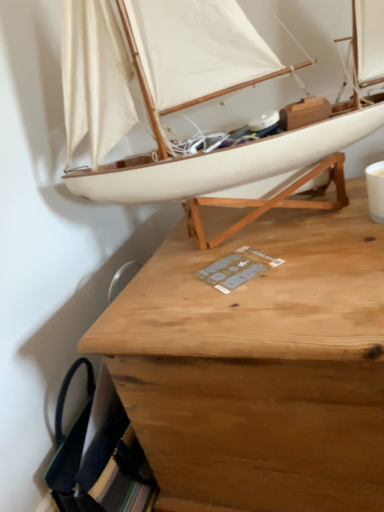
This screenshot has width=384, height=512. What do you see at coordinates (259, 366) in the screenshot? I see `wooden desk at center` at bounding box center [259, 366].

Locate an element on the screen. This screenshot has width=384, height=512. wooden desk at center is located at coordinates (259, 366).

This screenshot has width=384, height=512. What do you see at coordinates (230, 167) in the screenshot?
I see `white matte sailboat at upper center` at bounding box center [230, 167].

The image size is (384, 512). I want to click on white matte sailboat at upper center, so click(230, 167).

The width and height of the screenshot is (384, 512). Find the location of `wooden desk at center`. wooden desk at center is located at coordinates (259, 366).

Between wooden desk at center and white matte sailboat at upper center, which one appears on the right side from the viewer's perspective?

Positioned to the right is wooden desk at center.

Considering their positions, is wooden desk at center located in front of or behind white matte sailboat at upper center?

Visually, wooden desk at center is located behind white matte sailboat at upper center.

Is point (128, 397) positioned before point (294, 204)?

That is True.

From the image's perspective, is wooden desk at center above white matte sailboat at upper center?

Incorrect, from the image's perspective, wooden desk at center is lower than white matte sailboat at upper center.

From a real-world perspective, does wooden desk at center stand above white matte sailboat at upper center?

Actually, wooden desk at center is physically below white matte sailboat at upper center in the real world.

Between wooden desk at center and white matte sailboat at upper center, which one has larger width?

With larger width is wooden desk at center.

Does wooden desk at center have a lesser height compared to white matte sailboat at upper center?

No.

Is wooden desk at center bigger than white matte sailboat at upper center?

Yes, wooden desk at center is bigger than white matte sailboat at upper center.

Would you say wooden desk at center contains white matte sailboat at upper center?

No, wooden desk at center does not contain white matte sailboat at upper center.

Would you consider wooden desk at center to be distant from white matte sailboat at upper center?

No, wooden desk at center is not far away from white matte sailboat at upper center.

Is wooden desk at center facing towards white matte sailboat at upper center?

No, wooden desk at center is not facing towards white matte sailboat at upper center.

Can you tell me how much wooden desk at center and white matte sailboat at upper center differ in facing direction?

The angular difference between wooden desk at center and white matte sailboat at upper center is 0.266 degrees.

Locate an element on the screen. boat in front of the wooden desk at center is located at coordinates (230, 167).

From the picture: Which is more to the left, white matte sailboat at upper center or wooden desk at center?

From the viewer's perspective, white matte sailboat at upper center appears more on the left side.

In the scene shown: Does white matte sailboat at upper center lie in front of wooden desk at center?

Yes, white matte sailboat at upper center is closer to the camera.

Which point is more forward, (227, 197) or (200, 381)?

The point (200, 381) is closer.

From the image's perspective, is white matte sailboat at upper center positioned above or below wooden desk at center?

Clearly, from the image's perspective, white matte sailboat at upper center is above wooden desk at center.

From a real-world perspective, which object rests below the other?

wooden desk at center is physically lower.

Which of these two, white matte sailboat at upper center or wooden desk at center, is thinner?

With smaller width is white matte sailboat at upper center.

Considering the sizes of white matte sailboat at upper center and wooden desk at center in the image, is white matte sailboat at upper center taller or shorter than wooden desk at center?

white matte sailboat at upper center is shorter than wooden desk at center.

Can you confirm if white matte sailboat at upper center is bigger than wooden desk at center?

Actually, white matte sailboat at upper center might be smaller than wooden desk at center.

Would you say white matte sailboat at upper center is inside or outside wooden desk at center?

white matte sailboat at upper center lies outside wooden desk at center.

Is white matte sailboat at upper center far away from wooden desk at center?

Actually, white matte sailboat at upper center and wooden desk at center are a little close together.

Is white matte sailboat at upper center looking in the opposite direction of wooden desk at center?

white matte sailboat at upper center is not turned away from wooden desk at center.

Based on the photo, how many degrees apart are the facing directions of white matte sailboat at upper center and wooden desk at center?

0.266 degrees separate the facing orientations of white matte sailboat at upper center and wooden desk at center.

Measure the distance from white matte sailboat at upper center to wooden desk at center.

A distance of 10.16 inches exists between white matte sailboat at upper center and wooden desk at center.

Find the location of `desk lying below the white matte sailboat at upper center (from the image's perspective)`. desk lying below the white matte sailboat at upper center (from the image's perspective) is located at coordinates (259, 366).

Find the location of a particular element. desk below the white matte sailboat at upper center (from the image's perspective) is located at coordinates (259, 366).

The height and width of the screenshot is (512, 384). Find the location of `boat lying in front of the wooden desk at center`. boat lying in front of the wooden desk at center is located at coordinates (230, 167).